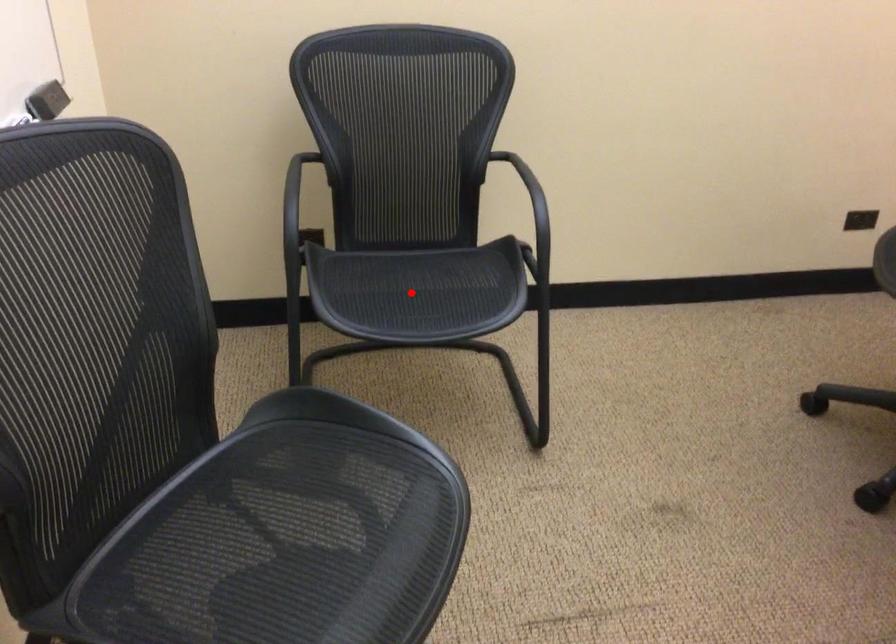
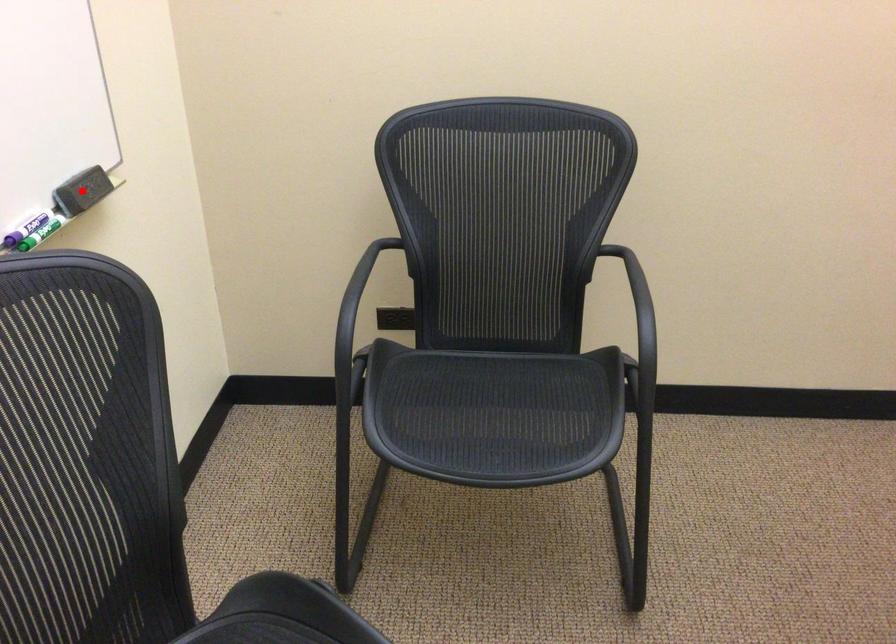
I am providing you with two images of the same scene from different viewpoints. A red point is marked on the first image and another point is marked on the second image. Do the highlighted points in image1 and image2 indicate the same real-world spot?

No